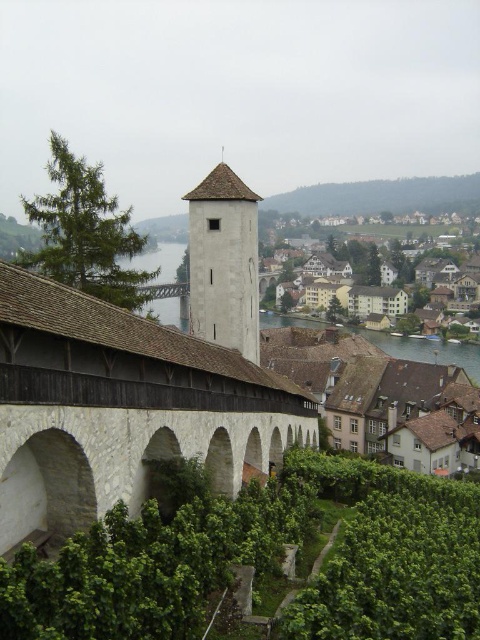
Which of these two, white stone bridge at center or white stone tower at center, stands shorter?

With less height is white stone bridge at center.

Based on the photo, how far apart are white stone bridge at center and white stone tower at center?

white stone bridge at center is 15.48 meters away from white stone tower at center.

Which is behind, point (115, 476) or point (216, 292)?

Point (216, 292)

Identify the location of white stone bridge at center. (120, 408).